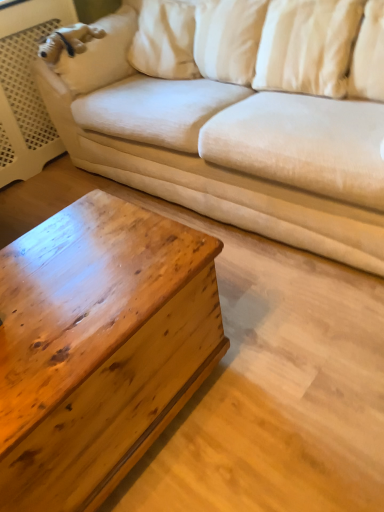
This screenshot has height=512, width=384. Describe the element at coordinates (234, 126) in the screenshot. I see `beige fabric couch at upper center` at that location.

I want to click on white soft pillow at upper right, which appears as the 2th pillow when viewed from the right, so click(308, 46).

Is white soft pillow at upper right, the first pillow viewed from the right, oriented towards beige fabric couch at upper center?

Yes, white soft pillow at upper right, the first pillow viewed from the right, is facing beige fabric couch at upper center.

Does point (380, 98) appear closer or farther from the camera than point (193, 6)?

Point (380, 98) appears to be closer to the viewer than point (193, 6).

Between white soft pillow at upper right, the first pillow viewed from the right, and beige fabric couch at upper center, which one has larger size?

beige fabric couch at upper center.

Which is correct: white soft pillow at upper right, the first pillow viewed from the right, is inside beige fabric couch at upper center, or outside of it?

The correct answer is: inside.

Which object is thinner, wooden chestnut coffee table at lower left or white soft pillow at upper right, which appears as the 2th pillow when viewed from the right?

white soft pillow at upper right, which appears as the 2th pillow when viewed from the right, is thinner.

How many degrees apart are the facing directions of wooden chestnut coffee table at lower left and white soft pillow at upper right, which appears as the 2th pillow when viewed from the right?

The angular difference between wooden chestnut coffee table at lower left and white soft pillow at upper right, which appears as the 2th pillow when viewed from the right, is 87.7 degrees.

Is wooden chestnut coffee table at lower left with white soft pillow at upper right, which appears as the 1th pillow when viewed from the left?

There is a gap between wooden chestnut coffee table at lower left and white soft pillow at upper right, which appears as the 1th pillow when viewed from the left.

In the image, is white soft pillow at upper right, which ranks as the 2th pillow in left-to-right order, positioned in front of or behind wooden chestnut coffee table at lower left?

white soft pillow at upper right, which ranks as the 2th pillow in left-to-right order, is positioned farther from the viewer than wooden chestnut coffee table at lower left.

Is point (375, 48) closer or farther from the camera than point (103, 276)?

Clearly, point (375, 48) is more distant from the camera than point (103, 276).

Is white soft pillow at upper right, the first pillow viewed from the right, turned away from wooden chestnut coffee table at lower left?

No, white soft pillow at upper right, the first pillow viewed from the right, is not facing the opposite direction of wooden chestnut coffee table at lower left.

Is white soft pillow at upper right, the first pillow viewed from the right, thinner than wooden chestnut coffee table at lower left?

Indeed, white soft pillow at upper right, the first pillow viewed from the right, has a lesser width compared to wooden chestnut coffee table at lower left.

From a real-world perspective, is white soft pillow at upper right, which ranks as the 2th pillow in left-to-right order, located higher than white soft pillow at upper right, which appears as the 2th pillow when viewed from the right?

Yes, from a real-world perspective, white soft pillow at upper right, which ranks as the 2th pillow in left-to-right order, is above white soft pillow at upper right, which appears as the 2th pillow when viewed from the right.

How many degrees apart are the facing directions of white soft pillow at upper right, the first pillow viewed from the right, and white soft pillow at upper right, which appears as the 1th pillow when viewed from the left?

There is a 5.96-degree angle between the facing directions of white soft pillow at upper right, the first pillow viewed from the right, and white soft pillow at upper right, which appears as the 1th pillow when viewed from the left.

Looking at their sizes, would you say white soft pillow at upper right, the first pillow viewed from the right, is wider or thinner than white soft pillow at upper right, which appears as the 1th pillow when viewed from the left?

white soft pillow at upper right, the first pillow viewed from the right, is thinner than white soft pillow at upper right, which appears as the 1th pillow when viewed from the left.

Looking at this image, is white soft pillow at upper right, which ranks as the 2th pillow in left-to-right order, turned away from white soft pillow at upper right, which appears as the 1th pillow when viewed from the left?

Yes.

From a real-world perspective, is white soft pillow at upper right, which appears as the 1th pillow when viewed from the left, physically located above or below wooden chestnut coffee table at lower left?

In terms of real-world spatial position, white soft pillow at upper right, which appears as the 1th pillow when viewed from the left, is above wooden chestnut coffee table at lower left.

Who is taller, white soft pillow at upper right, which appears as the 1th pillow when viewed from the left, or wooden chestnut coffee table at lower left?

wooden chestnut coffee table at lower left.

Based on the photo, considering the relative sizes of white soft pillow at upper right, which appears as the 2th pillow when viewed from the right, and wooden chestnut coffee table at lower left in the image provided, is white soft pillow at upper right, which appears as the 2th pillow when viewed from the right, wider than wooden chestnut coffee table at lower left?

No, white soft pillow at upper right, which appears as the 2th pillow when viewed from the right, is not wider than wooden chestnut coffee table at lower left.

Considering the sizes of objects beige fabric couch at upper center and white soft pillow at upper right, the first pillow viewed from the right, in the image provided, who is bigger, beige fabric couch at upper center or white soft pillow at upper right, the first pillow viewed from the right,?

beige fabric couch at upper center.

Who is taller, beige fabric couch at upper center or white soft pillow at upper right, which ranks as the 2th pillow in left-to-right order?

beige fabric couch at upper center is taller.

Can we say beige fabric couch at upper center lies outside white soft pillow at upper right, which ranks as the 2th pillow in left-to-right order?

beige fabric couch at upper center is positioned outside white soft pillow at upper right, which ranks as the 2th pillow in left-to-right order.

Is white soft pillow at upper right, which appears as the 2th pillow when viewed from the right, oriented towards white soft pillow at upper right, the first pillow viewed from the right?

No, white soft pillow at upper right, which appears as the 2th pillow when viewed from the right, is not oriented towards white soft pillow at upper right, the first pillow viewed from the right.

Which is correct: white soft pillow at upper right, which appears as the 2th pillow when viewed from the right, is inside white soft pillow at upper right, the first pillow viewed from the right, or outside of it?

white soft pillow at upper right, which appears as the 2th pillow when viewed from the right, is located beyond the bounds of white soft pillow at upper right, the first pillow viewed from the right.

Is white soft pillow at upper right, which appears as the 2th pillow when viewed from the right, to the left or to the right of white soft pillow at upper right, which ranks as the 2th pillow in left-to-right order, in the image?

In the image, white soft pillow at upper right, which appears as the 2th pillow when viewed from the right, appears on the left side of white soft pillow at upper right, which ranks as the 2th pillow in left-to-right order.

Is white soft pillow at upper right, which appears as the 1th pillow when viewed from the left, far away from white soft pillow at upper right, which ranks as the 2th pillow in left-to-right order?

Actually, white soft pillow at upper right, which appears as the 1th pillow when viewed from the left, and white soft pillow at upper right, which ranks as the 2th pillow in left-to-right order, are a little close together.

Where is `studio couch on the left of white soft pillow at upper right, which ranks as the 2th pillow in left-to-right order`? This screenshot has width=384, height=512. studio couch on the left of white soft pillow at upper right, which ranks as the 2th pillow in left-to-right order is located at coordinates tap(234, 126).

This screenshot has height=512, width=384. I want to click on coffee table that appears in front of the white soft pillow at upper right, which appears as the 1th pillow when viewed from the left, so click(98, 347).

Which object lies further to the anchor point wooden chestnut coffee table at lower left, white soft pillow at upper right, which ranks as the 2th pillow in left-to-right order, or white soft pillow at upper right, which appears as the 2th pillow when viewed from the right?

white soft pillow at upper right, which ranks as the 2th pillow in left-to-right order, is further to wooden chestnut coffee table at lower left.

In the scene shown: Estimate the real-world distances between objects in this image. Which object is closer to wooden chestnut coffee table at lower left, white soft pillow at upper right, which appears as the 1th pillow when viewed from the left, or white soft pillow at upper right, which ranks as the 2th pillow in left-to-right order?

Among the two, white soft pillow at upper right, which appears as the 1th pillow when viewed from the left, is located nearer to wooden chestnut coffee table at lower left.

Estimate the real-world distances between objects in this image. Which object is further from white soft pillow at upper right, which appears as the 2th pillow when viewed from the right, beige fabric couch at upper center or white soft pillow at upper right, which ranks as the 2th pillow in left-to-right order?

Based on the image, beige fabric couch at upper center appears to be further to white soft pillow at upper right, which appears as the 2th pillow when viewed from the right.

In the scene shown: Based on their spatial positions, is white soft pillow at upper right, the first pillow viewed from the right, or wooden chestnut coffee table at lower left further from white soft pillow at upper right, which appears as the 1th pillow when viewed from the left?

Among the two, wooden chestnut coffee table at lower left is located further to white soft pillow at upper right, which appears as the 1th pillow when viewed from the left.

Based on their spatial positions, is white soft pillow at upper right, which appears as the 2th pillow when viewed from the right, or beige fabric couch at upper center closer to wooden chestnut coffee table at lower left?

beige fabric couch at upper center.

From the image, which object appears to be farther from wooden chestnut coffee table at lower left, white soft pillow at upper right, the first pillow viewed from the right, or beige fabric couch at upper center?

white soft pillow at upper right, the first pillow viewed from the right, is further to wooden chestnut coffee table at lower left.

When comparing their distances from white soft pillow at upper right, which appears as the 1th pillow when viewed from the left, does wooden chestnut coffee table at lower left or beige fabric couch at upper center seem closer?

Among the two, beige fabric couch at upper center is located nearer to white soft pillow at upper right, which appears as the 1th pillow when viewed from the left.

Considering their positions, is beige fabric couch at upper center positioned further to white soft pillow at upper right, the first pillow viewed from the right, than white soft pillow at upper right, which appears as the 2th pillow when viewed from the right?

The object further to white soft pillow at upper right, the first pillow viewed from the right, is beige fabric couch at upper center.

Find the location of a particular element. pillow between white soft pillow at upper right, which appears as the 1th pillow when viewed from the left, and wooden chestnut coffee table at lower left, in the vertical direction is located at coordinates (369, 55).

You are a GUI agent. You are given a task and a screenshot of the screen. Output one action in this format:
    pyautogui.click(x=<x>, y=<y>)
    Task: Click on the pillow between beige fabric couch at upper center and wooden chestnut coffee table at lower left in the up-down direction
    Image resolution: width=384 pixels, height=512 pixels.
    Given the screenshot: What is the action you would take?
    [x=369, y=55]

This screenshot has width=384, height=512. I want to click on pillow between beige fabric couch at upper center and white soft pillow at upper right, which appears as the 2th pillow when viewed from the right, along the z-axis, so click(369, 55).

The image size is (384, 512). In order to click on studio couch that lies between white soft pillow at upper right, which appears as the 2th pillow when viewed from the right, and wooden chestnut coffee table at lower left from top to bottom in this screenshot , I will do `click(234, 126)`.